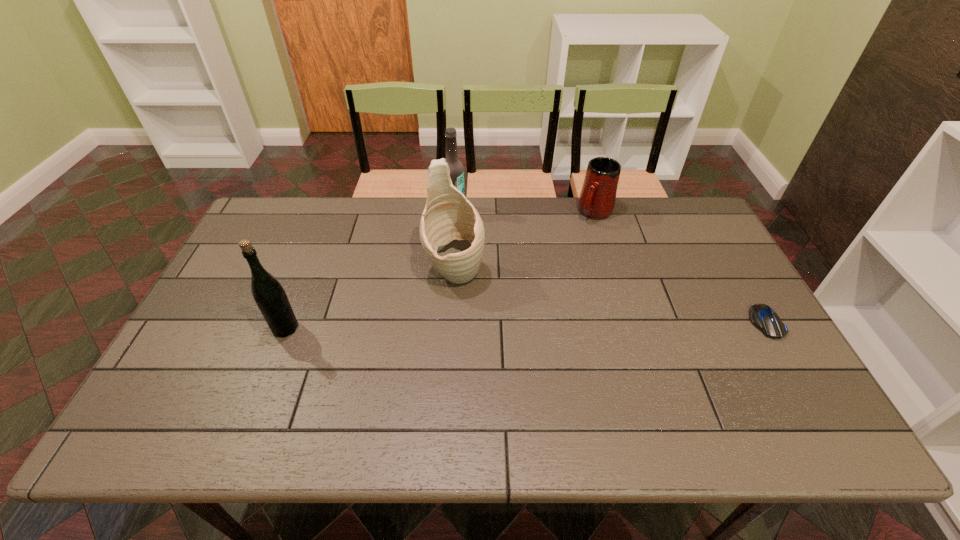
Locate an element on the screen. The image size is (960, 540). free spot on the desktop that is between the left beer bottle and the computer mouse and is positioned on the label of the right beer bottle is located at coordinates (551, 325).

Locate an element on the screen. free space on the desktop that is between the leftmost object and the shortest object and is positioned on the side of the fourth object from left to right with the handle is located at coordinates (507, 326).

This screenshot has width=960, height=540. Find the location of `free space on the desktop that is between the leftmost object and the computer mouse and is positioned at the spout of the pitcher`. free space on the desktop that is between the leftmost object and the computer mouse and is positioned at the spout of the pitcher is located at coordinates (471, 326).